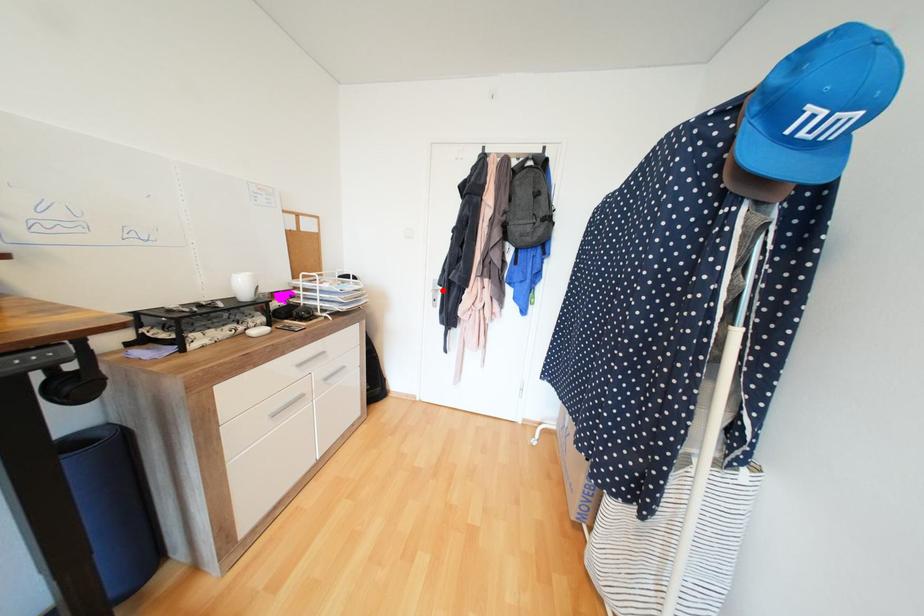
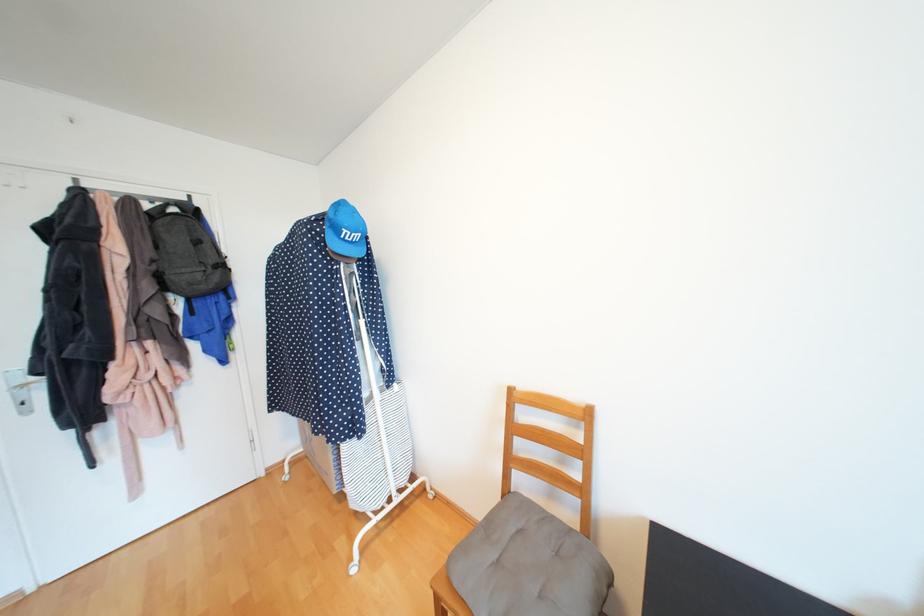
Where in the second image is the point corresponding to the highlighted location from the first image?

(30, 387)